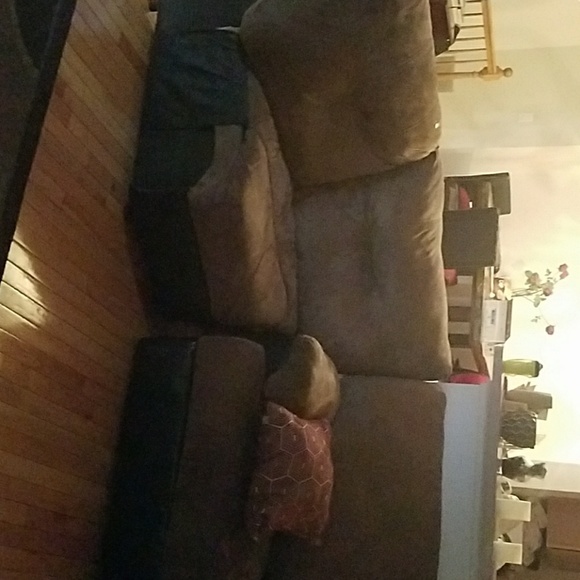
The image size is (580, 580). Find the location of `couch cushion`. couch cushion is located at coordinates (392, 447), (377, 296), (356, 92).